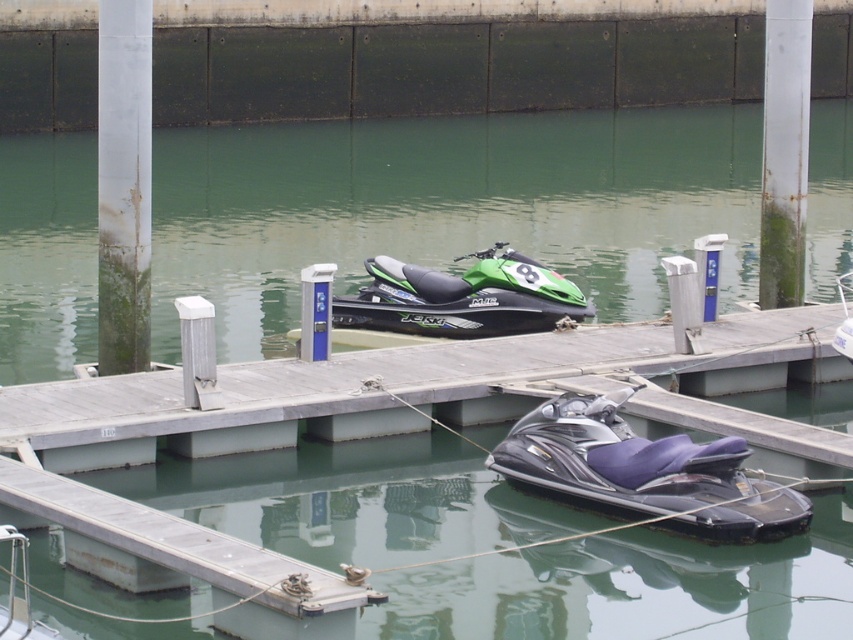
You are planning to move the shiny black jet ski at lower center onto the smooth gray dock at center. Based on their sizes, will the jet ski fit on the dock?

The smooth gray dock at center is narrower than the shiny black jet ski at lower center, so the jet ski will not fit on the dock.

You are standing at the edge of the wooden pier in the marina scene. You see the shiny black jet ski at lower center. If you want to walk to it from your current position, which direction should you move relative to the pier?

Since the shiny black jet ski at lower center is located at point 0.738 on the x and 0.756 on the y coordinates, you should move towards the lower center direction relative to the pier to reach it.

You are standing at the point marked by the coordinates point at [639,369]. There are two jet skis docked at the wooden pier. The first jet ski is black with purple accents on the seat and handlebars, and the second is green with black and white accents. Which jet ski is farther from your current position?

The second jet ski, which is green with black and white accents, is farther from your current position at point at [639,369].